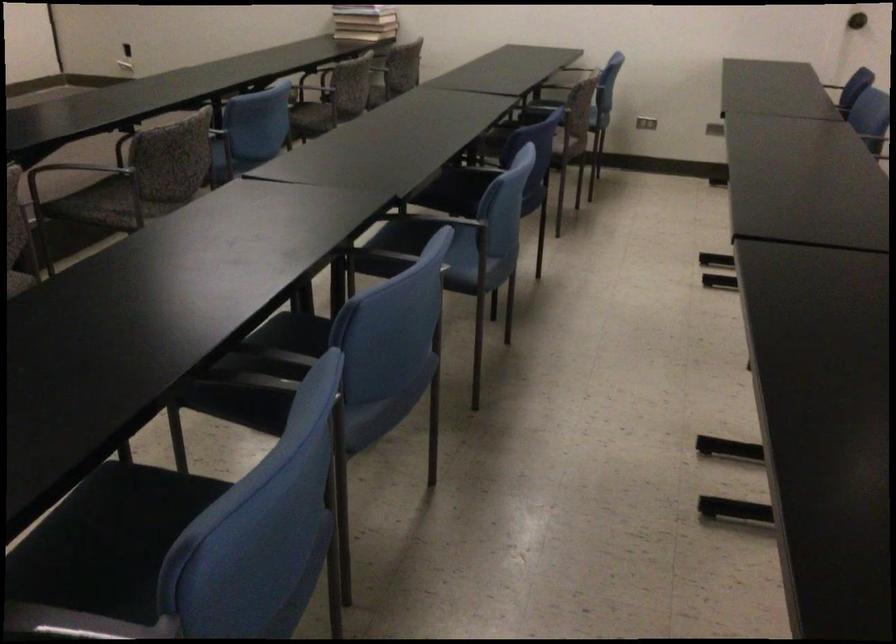
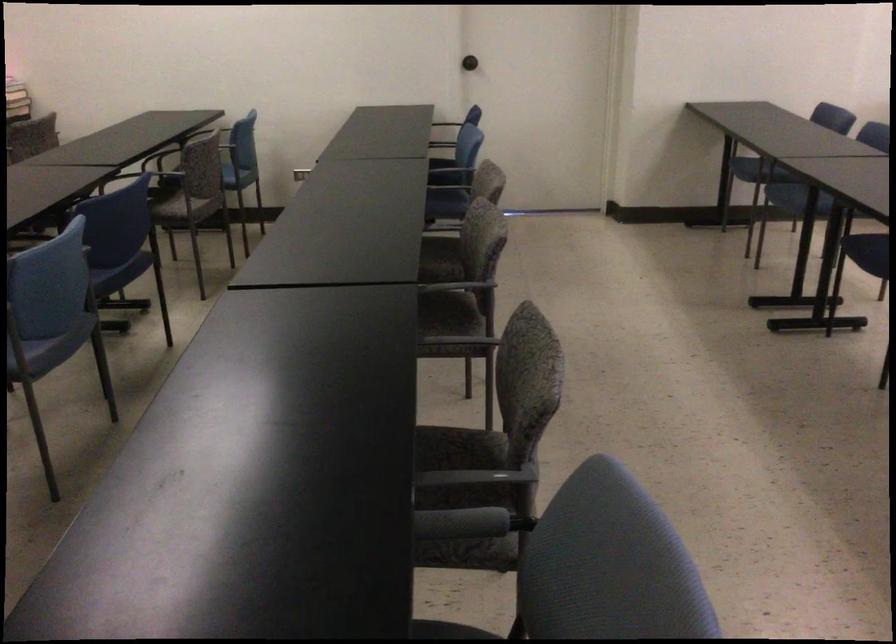
Question: The images are taken continuously from a first-person perspective. In which direction is your viewpoint rotating?

Choices:
 (A) Left
 (B) Right
 (C) Up
 (D) Down

Answer: (B)